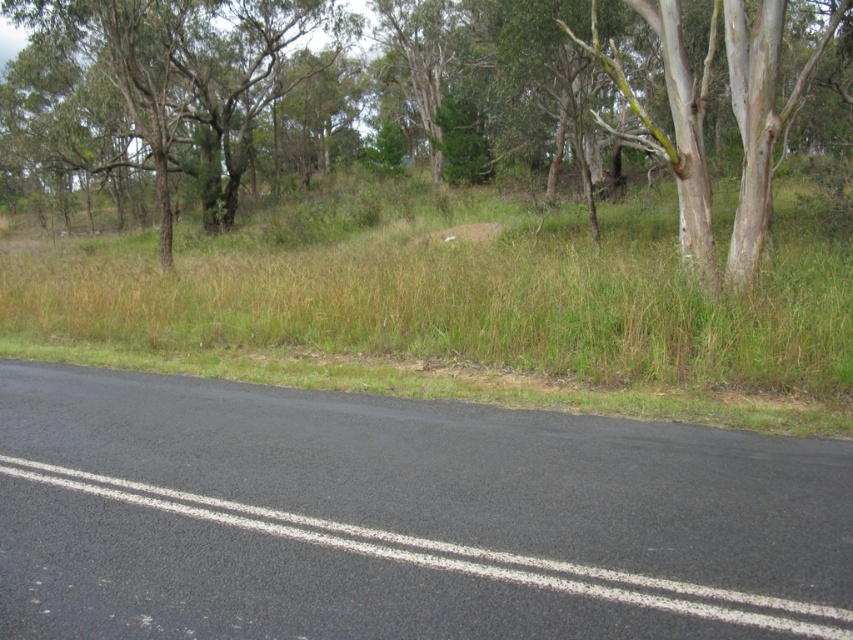
You are driving a car and see two points on the road ahead. The first point is at coordinate point (x=653, y=304) and the second is at point (x=701, y=156). Which point will you reach first while driving forward?

Point (x=653, y=304) is in front of point (x=701, y=156), so you will reach point (x=653, y=304) first while driving forward.

You are standing at point (465, 314) on the road. Looking around, what do you see immediately around you?

At point (465, 314), you are surrounded by green grass at center.